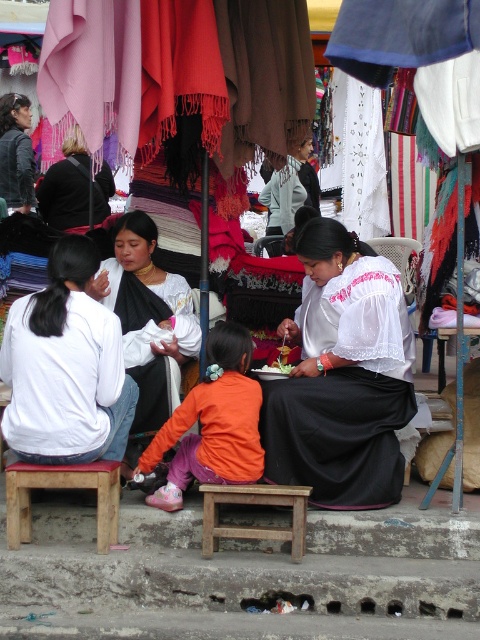
Who is more forward, (299, 435) or (233, 342)?

Point (233, 342) is more forward.

Does white lace blouse at center have a greater width compared to orange fabric at center?

Yes.

Between point (326, 502) and point (165, 497), which one is positioned behind?

Positioned behind is point (326, 502).

The height and width of the screenshot is (640, 480). I want to click on white lace blouse at center, so click(x=343, y=376).

Between black woven fabric at center and wooden stool at lower center, which one has less height?

wooden stool at lower center is shorter.

Is point (137, 240) positioned in front of point (208, 554)?

No, it is not.

Locate an element on the screen. The image size is (480, 640). black woven fabric at center is located at coordinates (147, 321).

Which is in front, point (263, 445) or point (19, 499)?

Point (19, 499) is more forward.

Is point (343, 292) behind point (108, 492)?

Yes.

Locate an element on the screen. The height and width of the screenshot is (640, 480). white lace blouse at center is located at coordinates (343, 376).